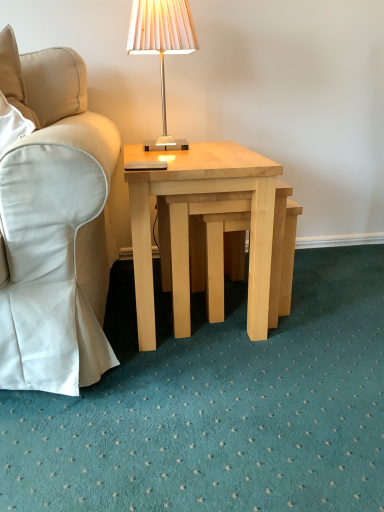
Question: From the image's perspective, is matte white lampshade at upper center above or below light wood step stool at center?

Choices:
 (A) above
 (B) below

Answer: (A)

Question: Looking at the image, does matte white lampshade at upper center seem bigger or smaller compared to light wood step stool at center?

Choices:
 (A) small
 (B) big

Answer: (A)

Question: Estimate the real-world distances between objects in this image. Which object is closer to the beige fabric chair at left?

Choices:
 (A) light wood step stool at center
 (B) matte white lampshade at upper center
 (C) light wood/natural wood coffee table at center

Answer: (C)

Question: Which is nearer to the matte white lampshade at upper center?

Choices:
 (A) beige fabric chair at left
 (B) light wood step stool at center
 (C) light wood/natural wood coffee table at center

Answer: (C)